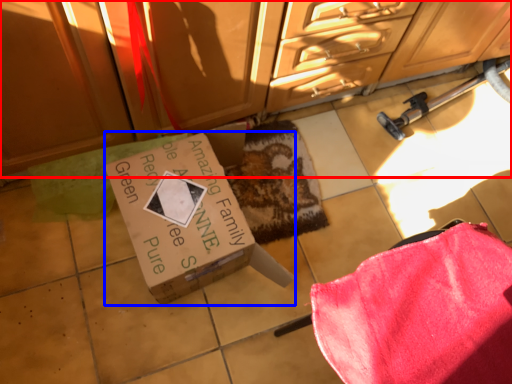
Question: Which object is further to the camera taking this photo, cabinetry (highlighted by a red box) or box (highlighted by a blue box)?

Choices:
 (A) cabinetry
 (B) box

Answer: (B)